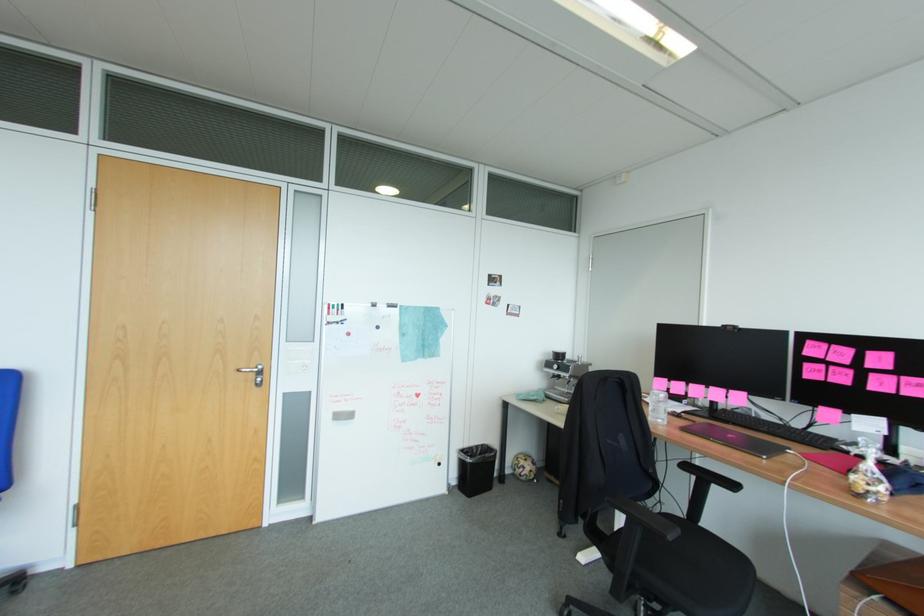
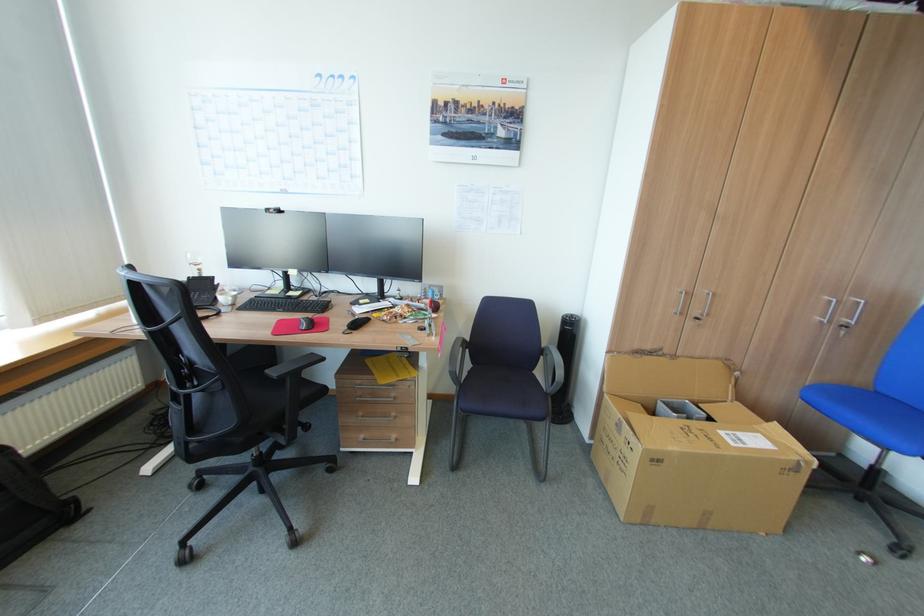
Based on the continuous images, in which direction is the camera rotating?

The camera rotated toward left-down.